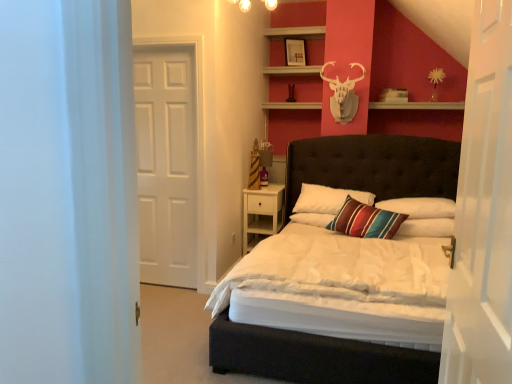
Question: Is white glossy door at right, the second door positioned from the left, shorter than white matte door at left, positioned as the 2th door in right-to-left order?

Choices:
 (A) no
 (B) yes

Answer: (B)

Question: From the image's perspective, would you say white glossy door at right, the 1th door from the right, is shown under white matte door at left, the 1th door viewed from the left?

Choices:
 (A) yes
 (B) no

Answer: (A)

Question: Is white matte door at left, the 1th door viewed from the left, surrounded by white glossy door at right, the first door viewed from the front?

Choices:
 (A) no
 (B) yes

Answer: (A)

Question: Is white glossy door at right, the 1th door from the right, smaller than white matte door at left, which ranks as the 2th door in front-to-back order?

Choices:
 (A) yes
 (B) no

Answer: (B)

Question: Is white glossy door at right, the first door viewed from the front, oriented away from white matte door at left, the 1th door viewed from the left?

Choices:
 (A) yes
 (B) no

Answer: (B)

Question: From a real-world perspective, is striped fabric pillow at center, which appears as the third pillow when viewed from the left, positioned above or below wooden shelf at upper center?

Choices:
 (A) above
 (B) below

Answer: (B)

Question: Visually, is striped fabric pillow at center, the first pillow from the right, positioned to the left or to the right of wooden shelf at upper center?

Choices:
 (A) right
 (B) left

Answer: (B)

Question: Is point (446, 223) closer or farther from the camera than point (438, 105)?

Choices:
 (A) closer
 (B) farther

Answer: (A)

Question: Relative to wooden shelf at upper center, is striped fabric pillow at center, the first pillow from the right, in front or behind?

Choices:
 (A) front
 (B) behind

Answer: (A)

Question: Is point (181, 110) closer or farther from the camera than point (350, 170)?

Choices:
 (A) closer
 (B) farther

Answer: (A)

Question: Is white matte door at left, positioned as the 2th door in right-to-left order, in front of or behind matte black bed at center in the image?

Choices:
 (A) behind
 (B) front

Answer: (A)

Question: Based on their sizes in the image, would you say white matte door at left, which ranks as the 2th door in front-to-back order, is bigger or smaller than matte black bed at center?

Choices:
 (A) big
 (B) small

Answer: (B)

Question: From a real-world perspective, is white matte door at left, which ranks as the 2th door in front-to-back order, physically located above or below matte black bed at center?

Choices:
 (A) below
 (B) above

Answer: (B)

Question: In terms of height, does striped fabric pillow at center, which appears as the third pillow when viewed from the left, look taller or shorter compared to white glossy door at right, which ranks as the 2th door in back-to-front order?

Choices:
 (A) short
 (B) tall

Answer: (A)

Question: Is striped fabric pillow at center, which appears as the third pillow when viewed from the left, wider or thinner than white glossy door at right, the 1th door from the right?

Choices:
 (A) thin
 (B) wide

Answer: (B)